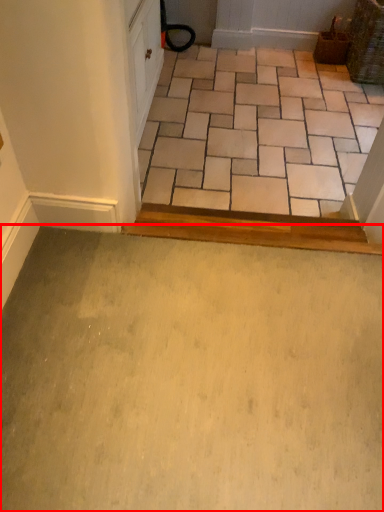
Question: From the image's perspective, where is path (annotated by the red box) located relative to ceramic tile?

Choices:
 (A) above
 (B) below

Answer: (B)